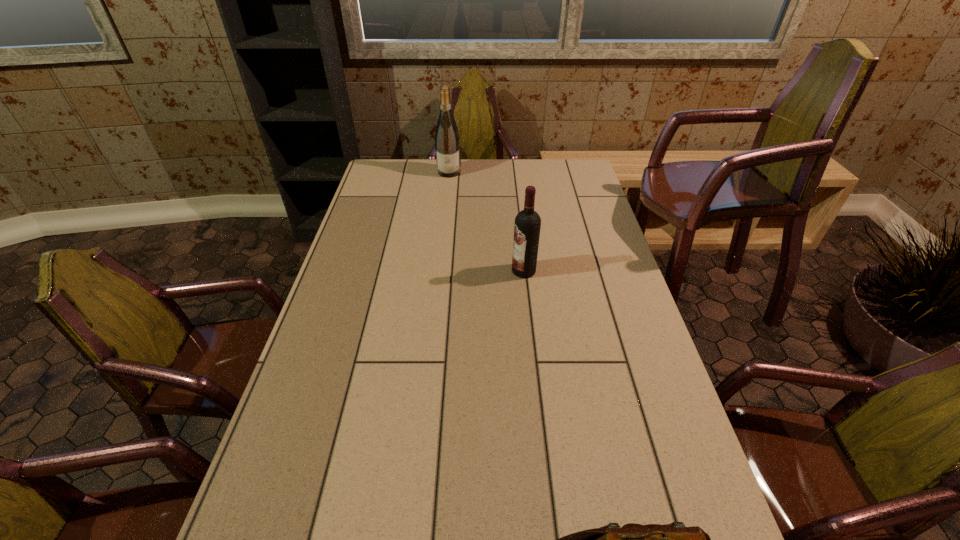
This screenshot has width=960, height=540. Identify the location of the leftmost object. (447, 140).

Identify the location of the farthest object. The width and height of the screenshot is (960, 540). (447, 140).

Locate an element on the screen. Image resolution: width=960 pixels, height=540 pixels. the second nearest object is located at coordinates (527, 225).

The image size is (960, 540). I want to click on the nearer wine bottle, so click(527, 225).

Where is `free region located 0.230m on the label of the farthest object`? The width and height of the screenshot is (960, 540). free region located 0.230m on the label of the farthest object is located at coordinates (445, 208).

This screenshot has width=960, height=540. I want to click on vacant space located on the label of the right wine bottle, so click(415, 271).

In order to click on free spot located on the label of the right wine bottle in this screenshot , I will do `click(492, 271)`.

This screenshot has height=540, width=960. What are the coordinates of `vacant space situated 0.240m on the label of the right wine bottle` in the screenshot? It's located at (437, 271).

Locate an element on the screen. This screenshot has height=540, width=960. object that is positioned at the far edge is located at coordinates (447, 140).

The image size is (960, 540). Find the location of `vacant area at the far edge of the desktop`. vacant area at the far edge of the desktop is located at coordinates (505, 167).